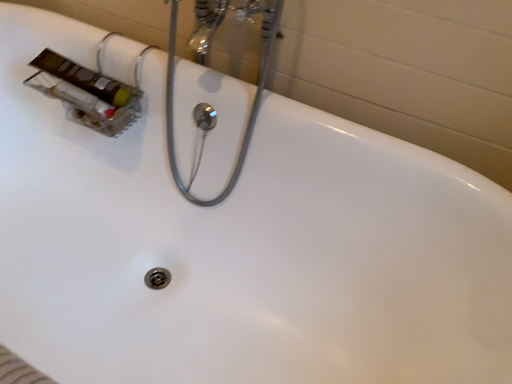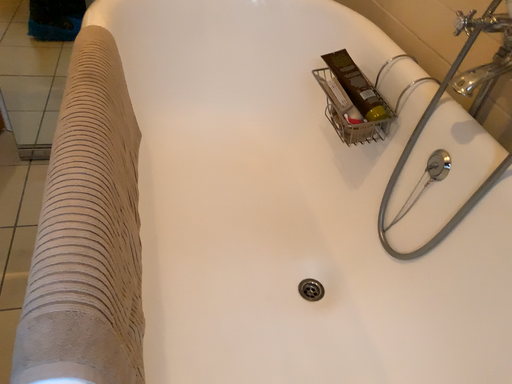
Question: How did the camera likely rotate when shooting the video?

Choices:
 (A) rotated left
 (B) rotated right

Answer: (A)